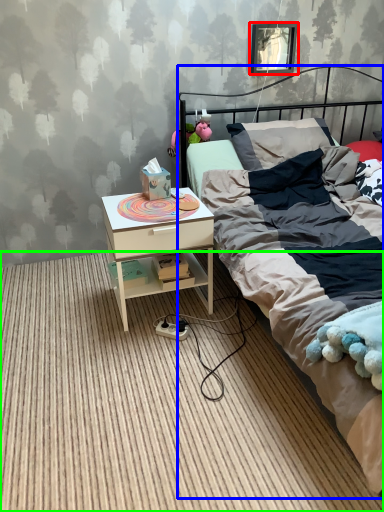
Question: Based on their relative distances, which object is farther from picture frame (highlighted by a red box)? Choose from bed (highlighted by a blue box) and plain (highlighted by a green box).

Choices:
 (A) bed
 (B) plain

Answer: (B)